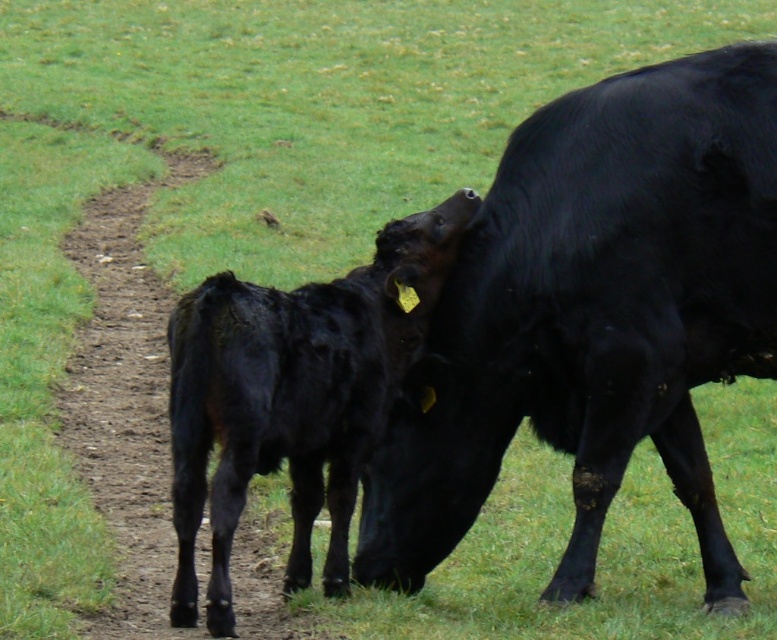
Question: Does black smooth cow at center have a greater width compared to shiny black calf at center?

Choices:
 (A) no
 (B) yes

Answer: (B)

Question: Is black smooth cow at center positioned behind shiny black calf at center?

Choices:
 (A) no
 (B) yes

Answer: (B)

Question: Is black smooth cow at center smaller than shiny black calf at center?

Choices:
 (A) yes
 (B) no

Answer: (B)